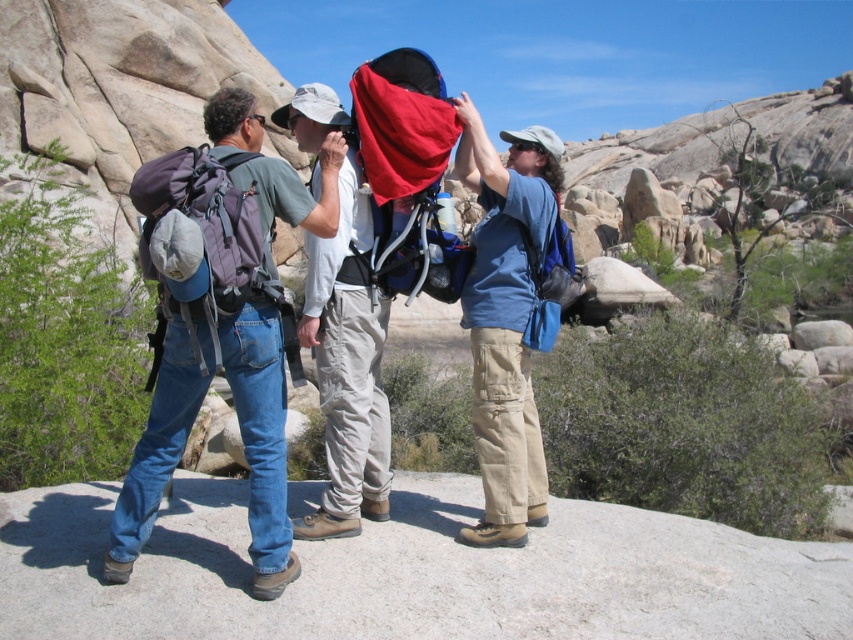
Question: Considering the real-world distances, which object is closest to the matte gray backpack at left?

Choices:
 (A) blue fabric backpack at center
 (B) matte gray backpack at center

Answer: (B)

Question: Can you confirm if blue fabric backpack at center is thinner than matte gray backpack at center?

Choices:
 (A) yes
 (B) no

Answer: (A)

Question: Which object is positioned closest to the matte gray backpack at left?

Choices:
 (A) blue fabric backpack at center
 (B) matte gray backpack at center

Answer: (B)

Question: Among these points, which one is nearest to the camera?

Choices:
 (A) tap(482, 246)
 (B) tap(311, 276)

Answer: (B)

Question: Can you confirm if blue fabric backpack at center is positioned above matte gray backpack at center?

Choices:
 (A) no
 (B) yes

Answer: (A)

Question: Observing the image, what is the correct spatial positioning of blue fabric backpack at center in reference to matte gray backpack at center?

Choices:
 (A) above
 (B) below

Answer: (B)